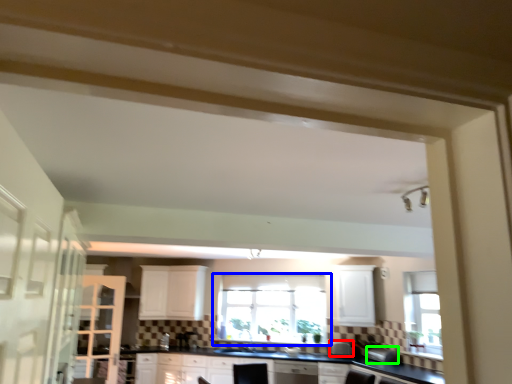
Question: Considering the real-world distances, which object is closest to appliance (highlighted by a red box)? window (highlighted by a blue box) or appliance (highlighted by a green box).

Choices:
 (A) window
 (B) appliance

Answer: (B)